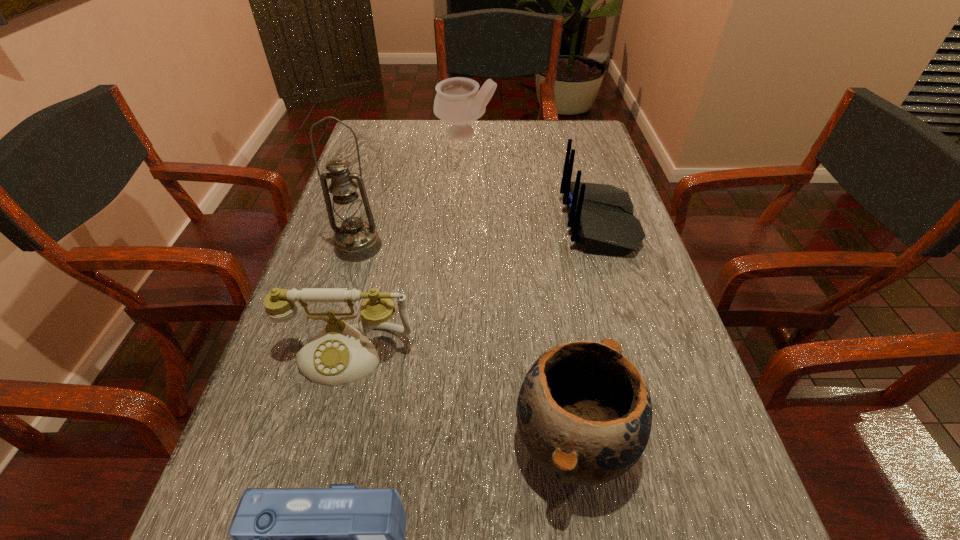
Image resolution: width=960 pixels, height=540 pixels. I want to click on free space at the left edge of the desktop, so click(x=357, y=321).

In the image, there is a desktop. Identify the location of free space at the right edge. (598, 294).

This screenshot has width=960, height=540. Find the location of `free space between the farther pottery and the oil lamp`. free space between the farther pottery and the oil lamp is located at coordinates (412, 190).

I want to click on vacant space that's between the fifth farthest object and the farthest object, so [519, 288].

I want to click on vacant area that lies between the farther pottery and the fifth farthest object, so click(x=519, y=288).

You are a GUI agent. You are given a task and a screenshot of the screen. Output one action in this format:
    pyautogui.click(x=<x>, y=<y>)
    Task: Click on the free space between the router and the fourth farthest object
    This screenshot has width=960, height=540.
    Given the screenshot: What is the action you would take?
    pyautogui.click(x=474, y=289)

Identify the location of vacant area that lies between the tallest object and the router. (479, 235).

Identify the location of free point between the fifth farthest object and the router. pos(587,333).

The height and width of the screenshot is (540, 960). Identify the location of empty location between the router and the third nearest object. (474, 289).

Where is `the fourth closest object relative to the farthest object`? This screenshot has height=540, width=960. the fourth closest object relative to the farthest object is located at coordinates 584,412.